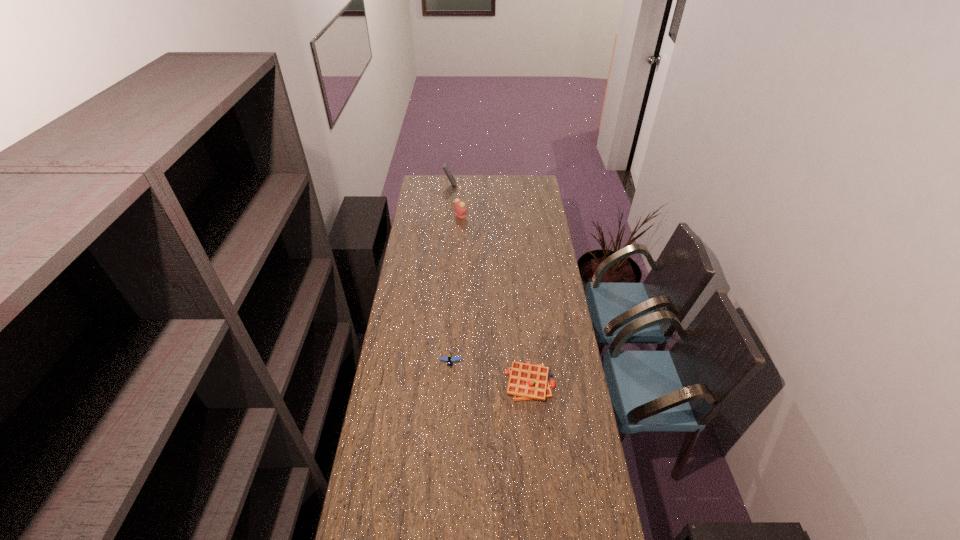
At what (x,y) coordinates should I click in order to perform the action: click on vacant space located on the front of the rightmost object. Please return your answer as a coordinate pair (x, y). Image resolution: width=960 pixels, height=540 pixels. Looking at the image, I should click on (538, 461).

Locate an element on the screen. object positioned at the far edge is located at coordinates [x=444, y=166].

You are a GUI agent. You are given a task and a screenshot of the screen. Output one action in this format:
    pyautogui.click(x=<x>, y=<y>)
    Task: Click on the object at the right edge
    Image resolution: width=960 pixels, height=540 pixels.
    Given the screenshot: What is the action you would take?
    pyautogui.click(x=526, y=382)

I want to click on vacant space at the left edge of the desktop, so click(x=423, y=260).

Image resolution: width=960 pixels, height=540 pixels. In the image, there is a desktop. Identify the location of vacant space at the right edge. (571, 373).

Image resolution: width=960 pixels, height=540 pixels. I want to click on vacant space at the far left corner of the desktop, so click(x=434, y=177).

Locate an element on the screen. The height and width of the screenshot is (540, 960). free area in between the third nearest object and the Lego is located at coordinates (455, 289).

The image size is (960, 540). In order to click on vacant space that is in between the rightmost object and the farthest object in this screenshot , I will do (490, 284).

This screenshot has height=540, width=960. I want to click on empty space that is in between the rightmost object and the calculator, so click(x=490, y=284).

In order to click on vacant space in between the second tallest object and the second shortest object in this screenshot , I will do `click(455, 289)`.